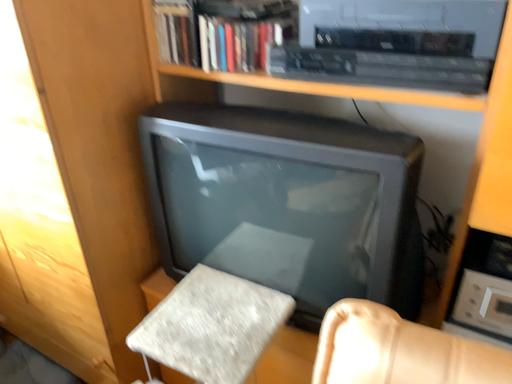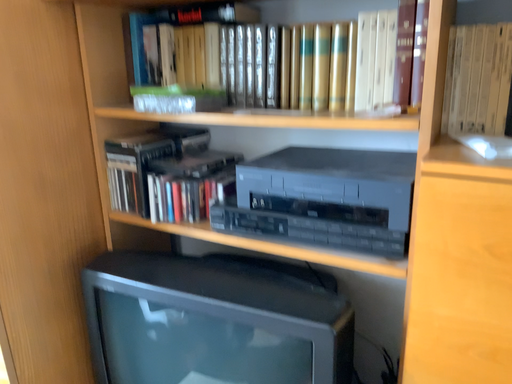
Question: Which way did the camera rotate in the video?

Choices:
 (A) rotated downward
 (B) rotated upward

Answer: (B)